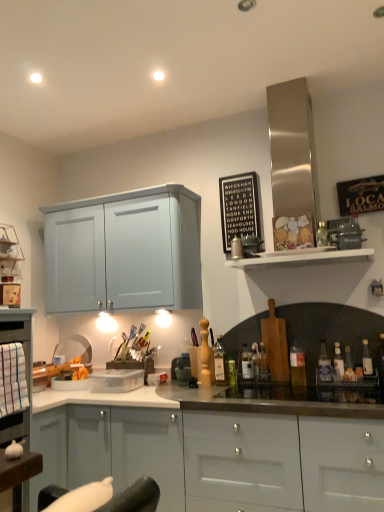
Question: Which direction should I rotate to look at translucent glass bottle at center, the fifth bottle when ordered from left to right?

Choices:
 (A) right
 (B) left

Answer: (A)

Question: Considering the relative sizes of translucent glass bottle at right, which is counted as the fifth bottle, starting from the right, and translucent plastic bottle at right, which ranks as the 8th bottle in left-to-right order, in the image provided, is translucent glass bottle at right, which is counted as the fifth bottle, starting from the right, wider than translucent plastic bottle at right, which ranks as the 8th bottle in left-to-right order,?

Choices:
 (A) yes
 (B) no

Answer: (A)

Question: Can you confirm if translucent glass bottle at right, which is counted as the fifth bottle, starting from the right, is positioned to the right of translucent plastic bottle at right, which appears as the third bottle when viewed from the right?

Choices:
 (A) yes
 (B) no

Answer: (B)

Question: Would you consider translucent glass bottle at right, which is counted as the fifth bottle, starting from the right, to be distant from translucent plastic bottle at right, which ranks as the 8th bottle in left-to-right order?

Choices:
 (A) yes
 (B) no

Answer: (B)

Question: From a real-world perspective, is translucent glass bottle at right, positioned as the sixth bottle in left-to-right order, physically below translucent plastic bottle at right, which appears as the third bottle when viewed from the right?

Choices:
 (A) no
 (B) yes

Answer: (A)

Question: Is translucent glass bottle at right, positioned as the sixth bottle in left-to-right order, positioned beyond the bounds of translucent plastic bottle at right, which ranks as the 8th bottle in left-to-right order?

Choices:
 (A) no
 (B) yes

Answer: (B)

Question: From the image's perspective, does translucent glass bottle at right, which is counted as the fifth bottle, starting from the right, appear higher than translucent plastic bottle at right, which ranks as the 8th bottle in left-to-right order?

Choices:
 (A) yes
 (B) no

Answer: (A)

Question: Is translucent glass bottle at center, the 10th bottle from the right, wider than metallic silver toaster at upper center, placed as the second appliance when sorted from front to back?

Choices:
 (A) yes
 (B) no

Answer: (B)

Question: Considering the relative positions of translucent glass bottle at center, the 10th bottle from the right, and metallic silver toaster at upper center, which appears as the second appliance when viewed from the right, in the image provided, is translucent glass bottle at center, the 10th bottle from the right, to the right of metallic silver toaster at upper center, which appears as the second appliance when viewed from the right, from the viewer's perspective?

Choices:
 (A) yes
 (B) no

Answer: (B)

Question: Is translucent glass bottle at center, the 10th bottle from the right, oriented towards metallic silver toaster at upper center, the 2th appliance from the back?

Choices:
 (A) yes
 (B) no

Answer: (B)

Question: Does translucent glass bottle at center, the 10th bottle from the right, have a greater height compared to metallic silver toaster at upper center, which appears as the second appliance when viewed from the right?

Choices:
 (A) yes
 (B) no

Answer: (A)

Question: Is translucent glass bottle at center, the 1th bottle from the left, touching metallic silver toaster at upper center, the 2th appliance positioned from the bottom?

Choices:
 (A) yes
 (B) no

Answer: (B)

Question: From the image's perspective, would you say translucent glass bottle at center, the 10th bottle from the right, is shown under metallic silver toaster at upper center, arranged as the second appliance when viewed from the top?

Choices:
 (A) yes
 (B) no

Answer: (A)

Question: Does black wood sign at upper center have a lesser height compared to metallic silver toaster at upper center, the 2th appliance positioned from the bottom?

Choices:
 (A) no
 (B) yes

Answer: (A)